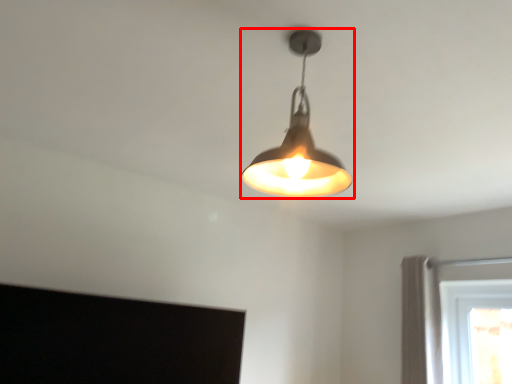
Question: From the image's perspective, where is lamp (annotated by the red box) located relative to curtain?

Choices:
 (A) above
 (B) below

Answer: (A)